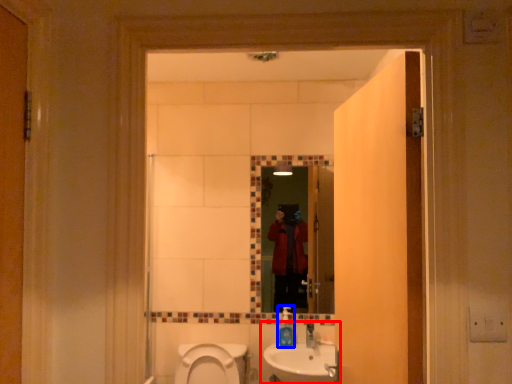
Question: Which point is further to the camera, sink (highlighted by a red box) or soap dispenser (highlighted by a blue box)?

Choices:
 (A) sink
 (B) soap dispenser

Answer: (B)